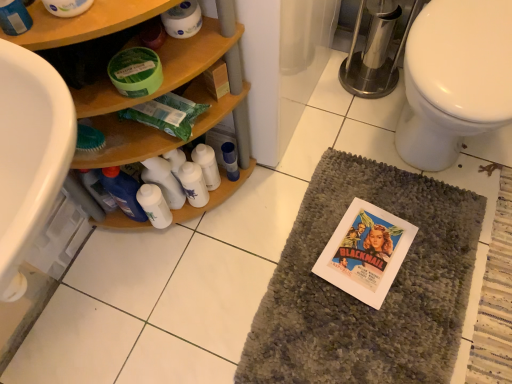
Locate an element on the screen. The width and height of the screenshot is (512, 384). unoccupied area in front of white matte lotion at center, marked as the 2th toiletry in a right-to-left arrangement is located at coordinates (165, 277).